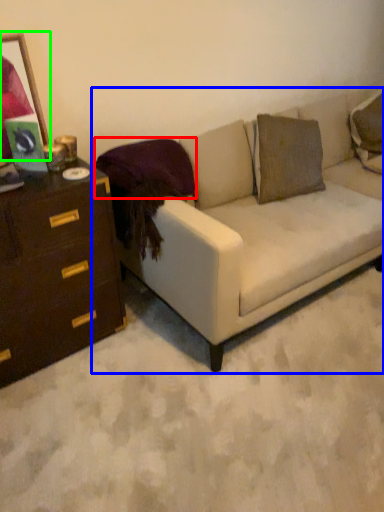
Question: Based on their relative distances, which object is nearer to pillow (highlighted by a red box)? Choose from studio couch (highlighted by a blue box) and picture frame (highlighted by a green box).

Choices:
 (A) studio couch
 (B) picture frame

Answer: (B)